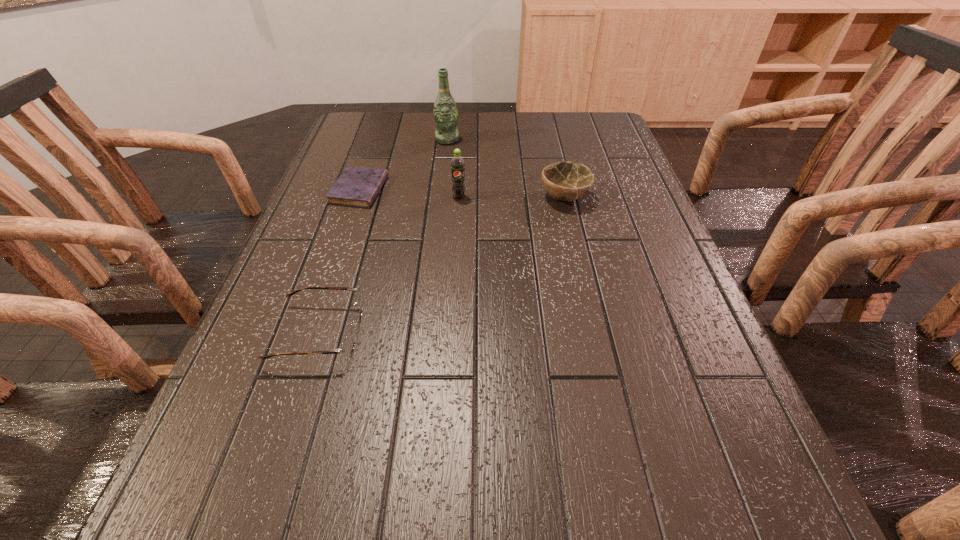
I want to click on vacant space at the far left corner, so click(x=354, y=119).

At what (x,y) coordinates should I click in order to perform the action: click on free space at the near right corner of the desktop. Please return your answer as a coordinate pair (x, y). Image resolution: width=960 pixels, height=540 pixels. Looking at the image, I should click on (741, 518).

You are a GUI agent. You are given a task and a screenshot of the screen. Output one action in this format:
    pyautogui.click(x=<x>, y=<y>)
    Task: Click on the empty space that is in between the tallest object and the bowl
    The width and height of the screenshot is (960, 540).
    Given the screenshot: What is the action you would take?
    pyautogui.click(x=506, y=168)

Identify the location of free space that is in between the beer bottle and the fourth tallest object. The width and height of the screenshot is (960, 540). (382, 237).

Where is `free space between the nearest object and the bowl`? This screenshot has height=540, width=960. free space between the nearest object and the bowl is located at coordinates (441, 265).

You are a GUI agent. You are given a task and a screenshot of the screen. Output one action in this format:
    pyautogui.click(x=<x>, y=<y>)
    Task: Click on the free space between the tallest object and the shortest object
    
    Given the screenshot: What is the action you would take?
    pyautogui.click(x=403, y=165)

Where is `vacant space that is in between the bowl and the soda`? vacant space that is in between the bowl and the soda is located at coordinates (512, 197).

Find the location of a particular element. The height and width of the screenshot is (540, 960). vacant space that is in between the diary and the tallest object is located at coordinates (403, 165).

Locate an element on the screen. The width and height of the screenshot is (960, 540). free space between the fourth tallest object and the third tallest object is located at coordinates (441, 265).

I want to click on free space between the spectacles and the fourth shortest object, so click(x=389, y=265).